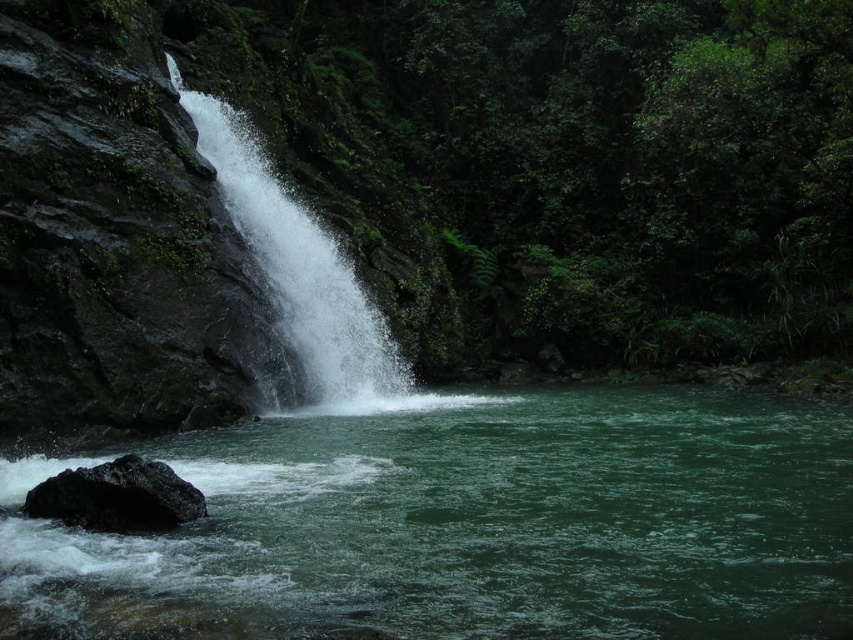
You are standing at the edge of the pool and want to place a small statue between the white frothy water at center and the black rough rock at lower left. According to the scene, which object should the statue be closer to?

The white frothy water at center is to the left of black rough rock at lower left, so the statue should be placed closer to the black rough rock at lower left since it is on the right side of the white frothy water at center.

You are a photographer standing at the edge of the pool. You want to capture both the white frothy water at center and the black rough rock at lower left in the same frame. Based on their sizes, which object should you focus on to ensure both are visible without zooming in or out?

The white frothy water at center might be wider than black rough rock at lower left, so focusing on the white frothy water at center would ensure both are visible since it is wider and occupies more space in the frame.

You are standing at the edge of the pool and want to reach both points marked in the scene. Which point, point (456, 604) or point (108, 467), will you encounter first as you move towards the waterfall?

Point (456, 604) is closer to the viewer than point (108, 467), so you will encounter point (456, 604) first as you move towards the waterfall.